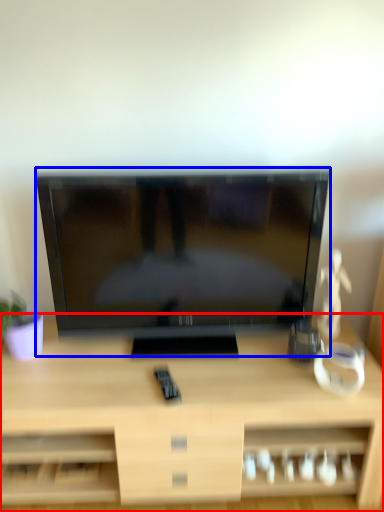
Question: Which object appears farthest to the camera in this image, desk (highlighted by a red box) or television (highlighted by a blue box)?

Choices:
 (A) desk
 (B) television

Answer: (B)